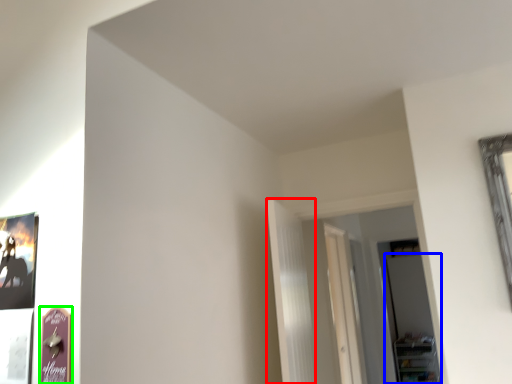
Question: Which object is positioned closest to curtain (highlighted by a red box)? Select from glass door (highlighted by a blue box) and picture frame (highlighted by a green box).

Choices:
 (A) glass door
 (B) picture frame

Answer: (B)